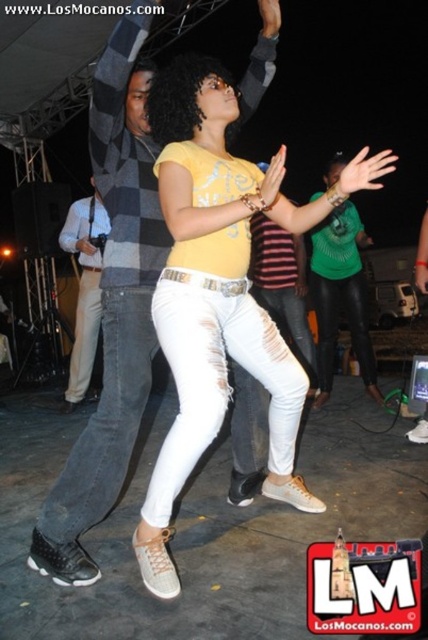
Question: Does denim jeans at center have a smaller size compared to light blue shirt at left?

Choices:
 (A) no
 (B) yes

Answer: (B)

Question: Which point is closer to the camera taking this photo?

Choices:
 (A) (74, 340)
 (B) (106, 83)

Answer: (B)

Question: Which object is closer to the camera taking this photo?

Choices:
 (A) green matte shirt at center
 (B) denim jeans at center
 (C) matte yellow shirt at center
 (D) light blue shirt at left

Answer: (C)

Question: Based on their relative distances, which object is farther from the denim jeans at center?

Choices:
 (A) green matte shirt at center
 (B) light blue shirt at left
 (C) matte yellow shirt at center

Answer: (B)

Question: Where is green matte shirt at center located in relation to light blue shirt at left in the image?

Choices:
 (A) below
 (B) above

Answer: (B)

Question: Is matte yellow shirt at center closer to camera compared to light blue shirt at left?

Choices:
 (A) no
 (B) yes

Answer: (B)